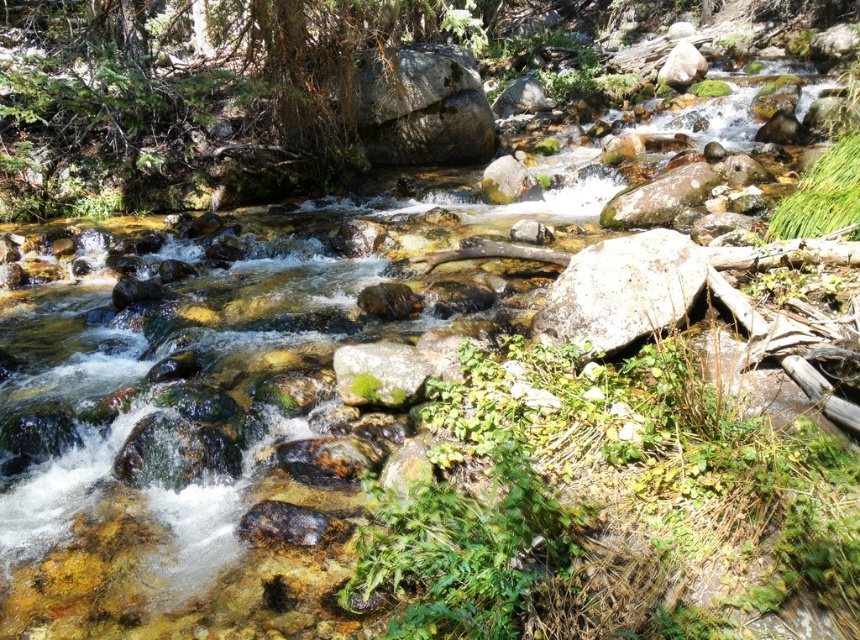
You are a hiker who wants to cross the stream but needs to step on the white textured rock at center and the green mossy rock at center. Which rock should you choose to step on if you want to avoid getting your boots wet?

The white textured rock at center is much taller than the green mossy rock at center, so stepping on the white textured rock at center would keep your boots drier as it is higher above the water level.

You are standing at the edge of the stream and see the white textured rock at center. Can you estimate its location in the image using coordinates?

The white textured rock at center is located at point coordinates of (622, 291).

You are standing at the edge of the stream and see the white textured rock at center and the green mossy rock at center. Which rock is positioned to the right when facing the stream?

The white textured rock at center is to the right of the green mossy rock at center when facing the stream.